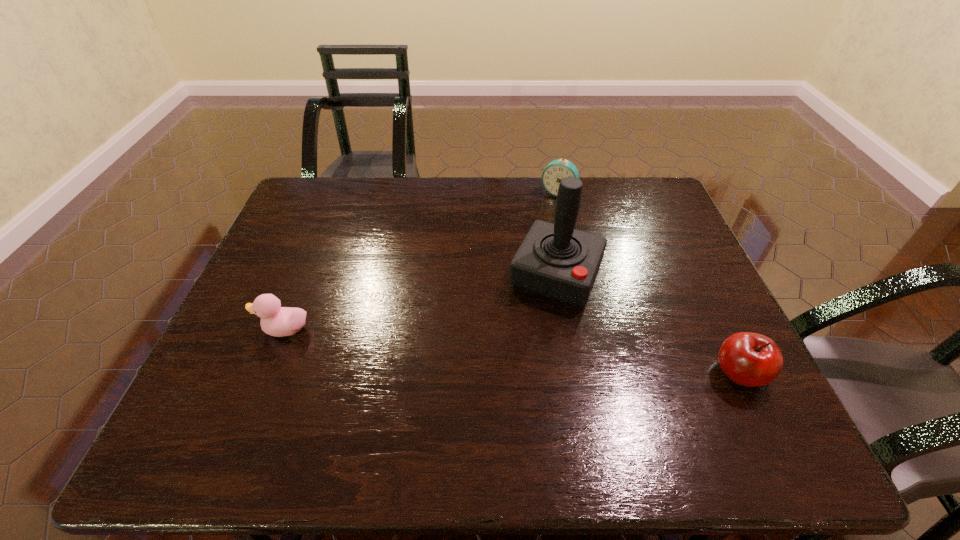
You are a GUI agent. You are given a task and a screenshot of the screen. Output one action in this format:
    pyautogui.click(x=<x>, y=<y>)
    Task: Click on the free space between the third farthest object and the third nearest object
    The image size is (960, 540).
    Given the screenshot: What is the action you would take?
    pyautogui.click(x=420, y=302)

At what (x,y) coordinates should I click in order to perform the action: click on unoccupied area between the nearest object and the farthest object. Please return your answer as a coordinate pair (x, y). The width and height of the screenshot is (960, 540). Looking at the image, I should click on (649, 283).

Find the location of a particular element. The height and width of the screenshot is (540, 960). unoccupied area between the second nearest object and the third nearest object is located at coordinates (420, 302).

Locate an element on the screen. The width and height of the screenshot is (960, 540). empty space between the apple and the third farthest object is located at coordinates (512, 352).

Find the location of a particular element. This screenshot has width=960, height=540. free space between the rightmost object and the farthest object is located at coordinates (649, 283).

The image size is (960, 540). I want to click on the closest object relative to the farthest object, so click(555, 260).

Identify which object is the nearest to the rightmost object. Please provide its 2D coordinates. Your answer should be formatted as a tuple, i.e. [(x, y)], where the tuple contains the x and y coordinates of a point satisfying the conditions above.

[(555, 260)]

At what (x,y) coordinates should I click in order to perform the action: click on free space that satisfies the following two spatial constraints: 1. on the back side of the farthest object; 2. on the right side of the third nearest object. Please return your answer as a coordinate pair (x, y). Looking at the image, I should click on (542, 193).